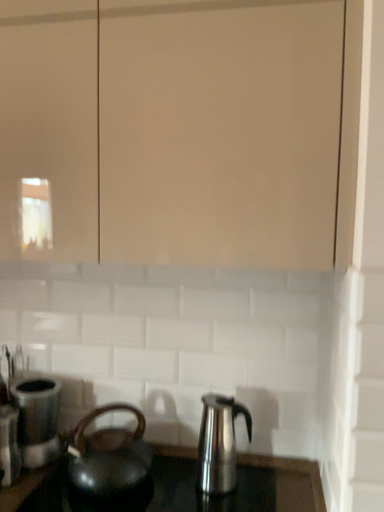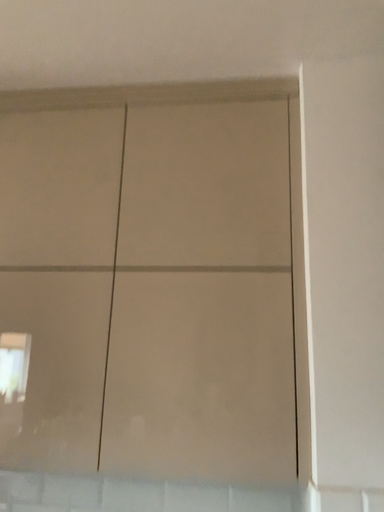
Question: Which way did the camera rotate in the video?

Choices:
 (A) rotated downward
 (B) rotated upward

Answer: (B)